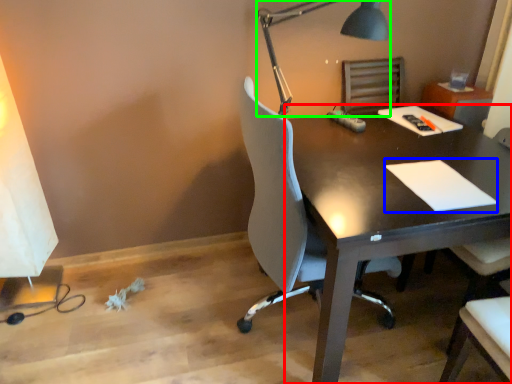
Question: Estimate the real-world distances between objects in this image. Which object is farther from desk (highlighted by a red box), notepad (highlighted by a blue box) or lamp (highlighted by a green box)?

Choices:
 (A) notepad
 (B) lamp

Answer: (B)